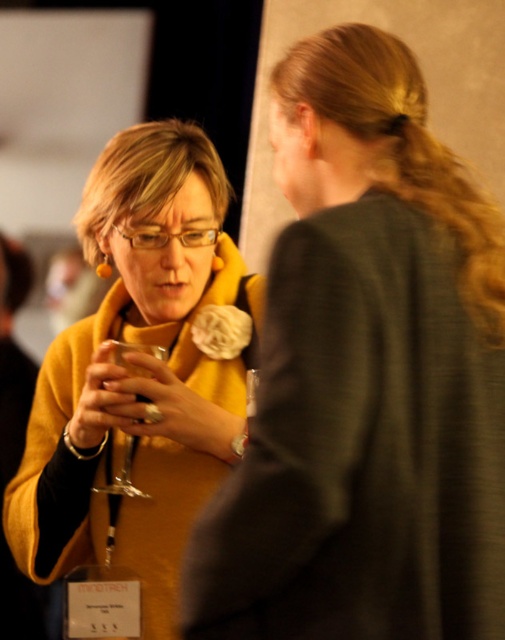
Question: Is matte yellow scarf at left below clear glass wine glass at center?

Choices:
 (A) no
 (B) yes

Answer: (A)

Question: Which point appears closest to the camera in this image?

Choices:
 (A) (192, 449)
 (B) (158, 419)

Answer: (B)

Question: Where is matte yellow sweater at center located in relation to clear glass wine glass at center in the image?

Choices:
 (A) below
 (B) above

Answer: (B)

Question: Is matte yellow scarf at left wider than matte yellow sweater at center?

Choices:
 (A) no
 (B) yes

Answer: (A)

Question: Which object is farther from the camera taking this photo?

Choices:
 (A) clear glass wine glass at center
 (B) matte yellow sweater at center

Answer: (A)

Question: Which object appears farthest from the camera in this image?

Choices:
 (A) matte yellow sweater at center
 (B) clear glass wine glass at center
 (C) matte yellow scarf at left

Answer: (B)